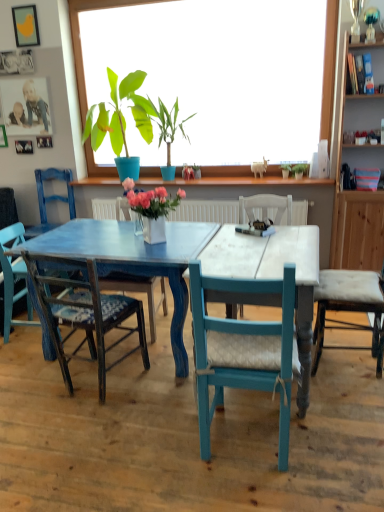
Question: From their relative heights in the image, would you say green leafy plant at upper center, the 5th houseplant in the front-to-back sequence, is taller or shorter than green matte plant at upper center, placed as the first houseplant when sorted from right to left?

Choices:
 (A) tall
 (B) short

Answer: (A)

Question: Is green leafy plant at upper center, the 4th houseplant when ordered from left to right, wider or thinner than green matte plant at upper center, acting as the 5th houseplant starting from the left?

Choices:
 (A) thin
 (B) wide

Answer: (A)

Question: Which is nearer to the blue woven fabric chair at center, positioned as the 3th chair in left-to-right order?

Choices:
 (A) wooden bookshelf at upper right
 (B) brushed metal picture frame at upper left, which is counted as the 4th picture frame, starting from the top
 (C) white upholstered chair at right, positioned as the sixth chair in left-to-right order
 (D) blue wood chair at left, acting as the 1th chair starting from the left
 (E) green leafy plant at upper center, the 5th houseplant in the front-to-back sequence

Answer: (C)

Question: Which is nearer to the wooden woven chair at lower left, which ranks as the fifth chair in right-to-left order?

Choices:
 (A) white upholstered chair at right, positioned as the sixth chair in left-to-right order
 (B) green matte plant at center, which appears as the 2th houseplant when viewed from the front
 (C) brushed metal picture frame at upper left, the 2th picture frame from the bottom
 (D) green matte plant at upper center, acting as the 5th houseplant starting from the left
 (E) brushed metal picture frame at upper left, arranged as the fifth picture frame when viewed from the top

Answer: (A)